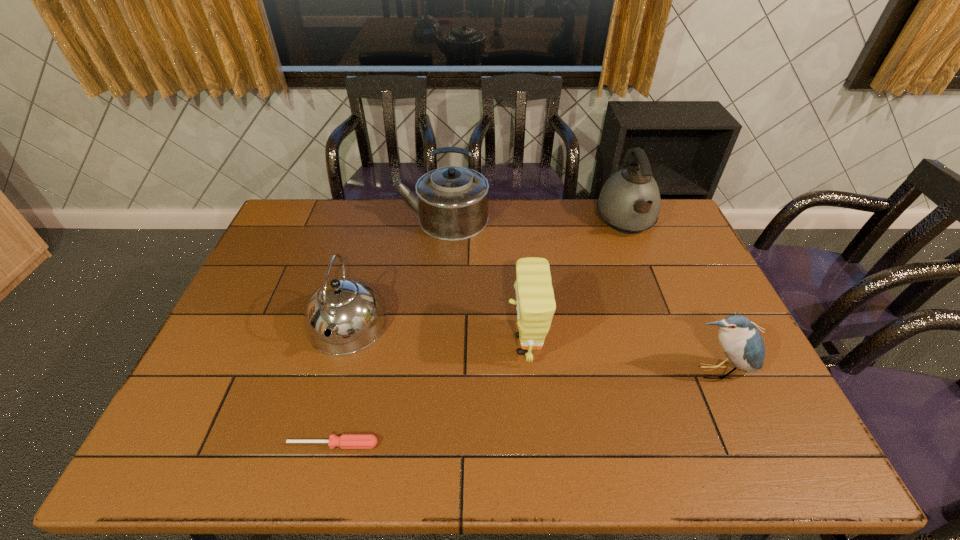
Image resolution: width=960 pixels, height=540 pixels. Find the location of `empty location between the sponge and the rightmost kettle`. empty location between the sponge and the rightmost kettle is located at coordinates (575, 284).

I want to click on object that is the second closest one to the shortest kettle, so click(452, 202).

Image resolution: width=960 pixels, height=540 pixels. Identify the location of object that is the fourth nearest to the nearest kettle. (629, 202).

What are the coordinates of `kettle that can be found as the closest to the bird` in the screenshot? It's located at (629, 202).

Image resolution: width=960 pixels, height=540 pixels. What are the coordinates of `kettle that is the second closest to the bird` in the screenshot? It's located at (452, 202).

Find the location of a particular element. The width and height of the screenshot is (960, 540). vacant region that satisfies the following two spatial constraints: 1. at the spout of the rightmost kettle; 2. on the face of the sponge is located at coordinates (675, 345).

Find the location of a particular element. The image size is (960, 540). blank space that satisfies the following two spatial constraints: 1. at the spout of the rightmost kettle; 2. on the face of the fourth object from left to right is located at coordinates (675, 345).